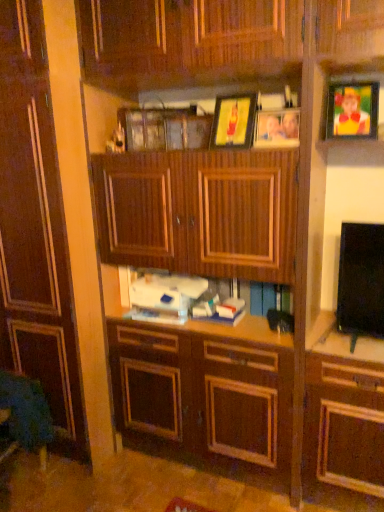
Question: Is wooden picture frame at upper center, acting as the 3th picture frame starting from the right, positioned in front of matte plastic picture frame at upper right, which is counted as the 1th picture frame, starting from the right?

Choices:
 (A) no
 (B) yes

Answer: (A)

Question: Can you confirm if wooden picture frame at upper center, the first picture frame viewed from the left, is taller than matte plastic picture frame at upper right, the third picture frame from the left?

Choices:
 (A) no
 (B) yes

Answer: (B)

Question: Considering the relative sizes of wooden picture frame at upper center, the first picture frame viewed from the left, and matte plastic picture frame at upper right, which is counted as the 1th picture frame, starting from the right, in the image provided, is wooden picture frame at upper center, the first picture frame viewed from the left, wider than matte plastic picture frame at upper right, which is counted as the 1th picture frame, starting from the right,?

Choices:
 (A) yes
 (B) no

Answer: (B)

Question: Are wooden picture frame at upper center, the first picture frame viewed from the left, and matte plastic picture frame at upper right, the third picture frame from the left, located far from each other?

Choices:
 (A) yes
 (B) no

Answer: (B)

Question: Does wooden picture frame at upper center, acting as the 3th picture frame starting from the right, appear on the right side of matte plastic picture frame at upper right, which is counted as the 1th picture frame, starting from the right?

Choices:
 (A) no
 (B) yes

Answer: (A)

Question: From the image's perspective, is dark wood cabinet at center positioned above or below matte plastic picture frame at upper right, which is counted as the 1th picture frame, starting from the right?

Choices:
 (A) above
 (B) below

Answer: (B)

Question: In terms of width, does dark wood cabinet at center look wider or thinner when compared to matte plastic picture frame at upper right, the third picture frame from the left?

Choices:
 (A) thin
 (B) wide

Answer: (B)

Question: In the image, is dark wood cabinet at center positioned in front of or behind matte plastic picture frame at upper right, which is counted as the 1th picture frame, starting from the right?

Choices:
 (A) front
 (B) behind

Answer: (B)

Question: Do you think dark wood cabinet at center is within matte plastic picture frame at upper right, which is counted as the 1th picture frame, starting from the right, or outside of it?

Choices:
 (A) outside
 (B) inside

Answer: (A)

Question: Is wooden picture frame at upper center, the first picture frame viewed from the left, to the left or to the right of matte plastic picture frame at upper right, which is counted as the 1th picture frame, starting from the right, in the image?

Choices:
 (A) right
 (B) left

Answer: (B)

Question: Looking at the image, does wooden picture frame at upper center, acting as the 3th picture frame starting from the right, seem bigger or smaller compared to matte plastic picture frame at upper right, which is counted as the 1th picture frame, starting from the right?

Choices:
 (A) big
 (B) small

Answer: (B)

Question: Is wooden picture frame at upper center, the first picture frame viewed from the left, taller or shorter than matte plastic picture frame at upper right, which is counted as the 1th picture frame, starting from the right?

Choices:
 (A) short
 (B) tall

Answer: (B)

Question: Does point (218, 108) appear closer or farther from the camera than point (367, 91)?

Choices:
 (A) closer
 (B) farther

Answer: (B)

Question: Considering the positions of point (236, 143) and point (18, 176), is point (236, 143) closer or farther from the camera than point (18, 176)?

Choices:
 (A) closer
 (B) farther

Answer: (A)

Question: Would you say wooden picture frame at upper center, the first picture frame viewed from the left, is to the left or to the right of dark wood cabinet at center in the picture?

Choices:
 (A) left
 (B) right

Answer: (B)